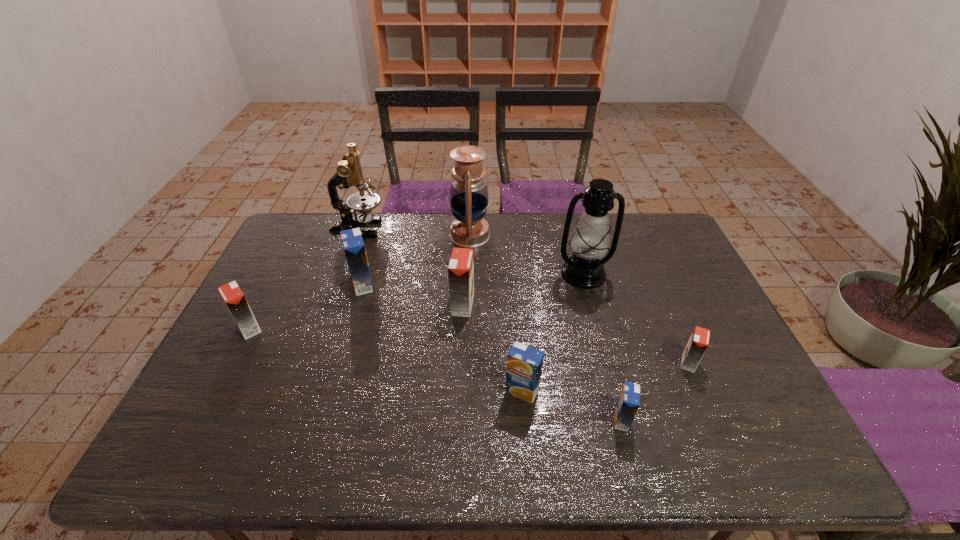
Find the location of a particular element. empty space between the farther oil lamp and the rightmost orange_juice is located at coordinates (579, 299).

This screenshot has height=540, width=960. I want to click on empty location between the farthest blue orange_juice and the rightmost orange orange juice, so click(525, 323).

You are a GUI agent. You are given a task and a screenshot of the screen. Output one action in this format:
    pyautogui.click(x=<x>, y=<y>)
    Task: Click on the blank region between the fifth farthest orange_juice and the second orange orange juice from left to right
    The width and height of the screenshot is (960, 540).
    Given the screenshot: What is the action you would take?
    pyautogui.click(x=492, y=348)

Locate an element on the screen. vacant point located between the leftmost orange orange juice and the third nearest orange_juice is located at coordinates (468, 346).

The width and height of the screenshot is (960, 540). In order to click on vacant point located between the third orange_juice from left to right and the fifth orange_juice from right to left in this screenshot , I will do `click(413, 295)`.

In order to click on vacant space in between the right oil lamp and the left oil lamp in this screenshot , I will do `click(527, 254)`.

I want to click on vacant region between the fourth object from right to left and the leftmost orange_juice, so click(x=386, y=360).

You are a GUI agent. You are given a task and a screenshot of the screen. Output one action in this format:
    pyautogui.click(x=<x>, y=<y>)
    Task: Click on the vacant area that lies between the second smallest blue orange_juice and the rightmost object
    
    Given the screenshot: What is the action you would take?
    pyautogui.click(x=606, y=377)

Where is `vacant space that is in between the second orange_juice from left to right and the second farthest orange orange juice`? This screenshot has width=960, height=540. vacant space that is in between the second orange_juice from left to right and the second farthest orange orange juice is located at coordinates (306, 307).

Locate an element on the screen. The width and height of the screenshot is (960, 540). object that is the eighth closest to the fifth orange_juice from left to right is located at coordinates (232, 295).